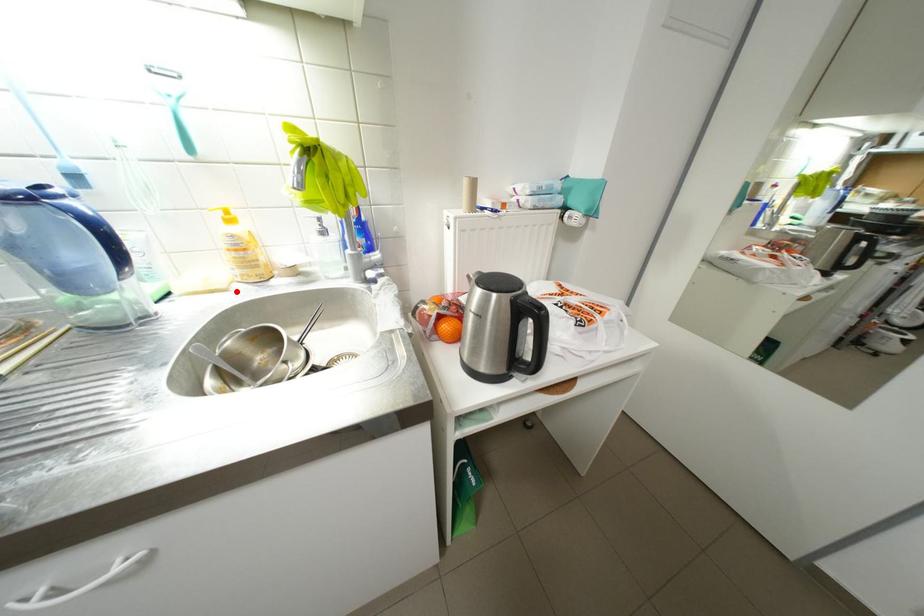
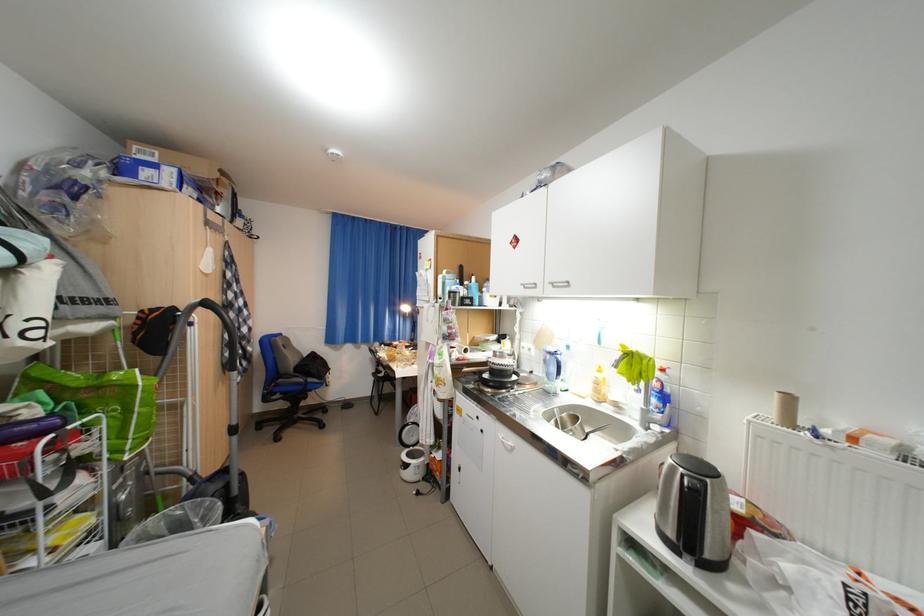
Question: I am providing you with two images of the same scene from different viewpoints. A red point is marked on the first image. Can you still see the location of the red point in image 2?

Choices:
 (A) Yes
 (B) No

Answer: (A)